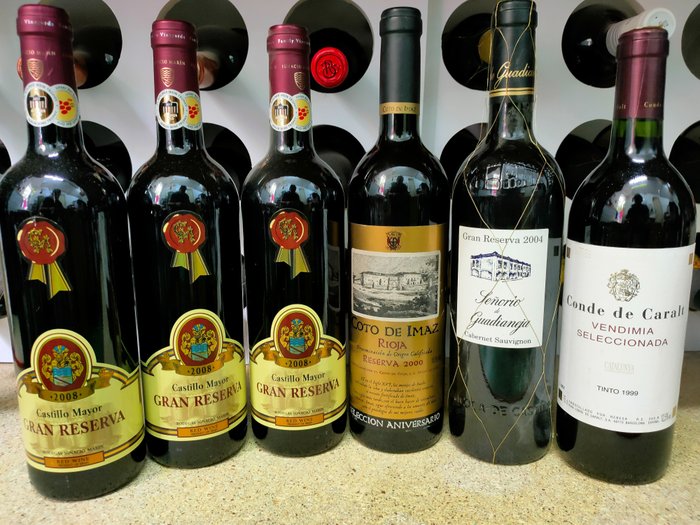
Find the location of `bottle`. bottle is located at coordinates (105, 483).